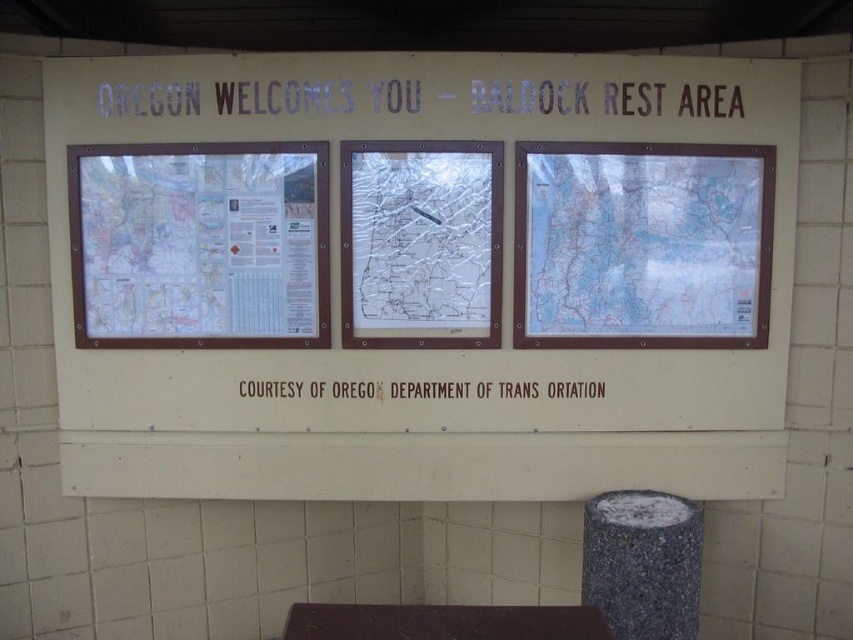
Question: Is granite-like textured pillar at lower right further to camera compared to brown wood stool at lower center?

Choices:
 (A) yes
 (B) no

Answer: (A)

Question: Which point is closer to the camera taking this photo?

Choices:
 (A) (247, 156)
 (B) (631, 524)
 (C) (494, 465)

Answer: (B)

Question: Estimate the real-world distances between objects in this image. Which object is farther from the brown wood stool at lower center?

Choices:
 (A) blue paper map at center
 (B) brown paper text at center
 (C) white plastic sign at upper center
 (D) transparent plastic map at center

Answer: (C)

Question: From the image, what is the correct spatial relationship of white matte signboard at center in relation to brown wood stool at lower center?

Choices:
 (A) above
 (B) below

Answer: (A)

Question: From the image, what is the correct spatial relationship of white plastic sign at upper center in relation to brown paper text at center?

Choices:
 (A) left
 (B) right

Answer: (B)

Question: Which object is the farthest from the blue paper map at center?

Choices:
 (A) brown paper text at center
 (B) white matte signboard at center
 (C) granite-like textured pillar at lower right
 (D) brown wood stool at lower center

Answer: (D)